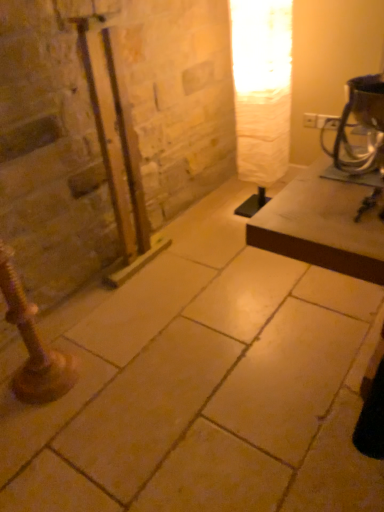
Find the location of a particular element. The height and width of the screenshot is (512, 384). matte stone concrete at center is located at coordinates (201, 385).

The image size is (384, 512). Describe the element at coordinates (201, 385) in the screenshot. I see `matte stone concrete at center` at that location.

Find the location of `matte stone concrete at center`. matte stone concrete at center is located at coordinates (201, 385).